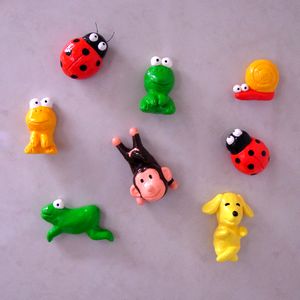
Locate an element on the screen. toy is located at coordinates (86, 58), (154, 86), (264, 85), (245, 151), (227, 225), (146, 176), (41, 129), (69, 222).